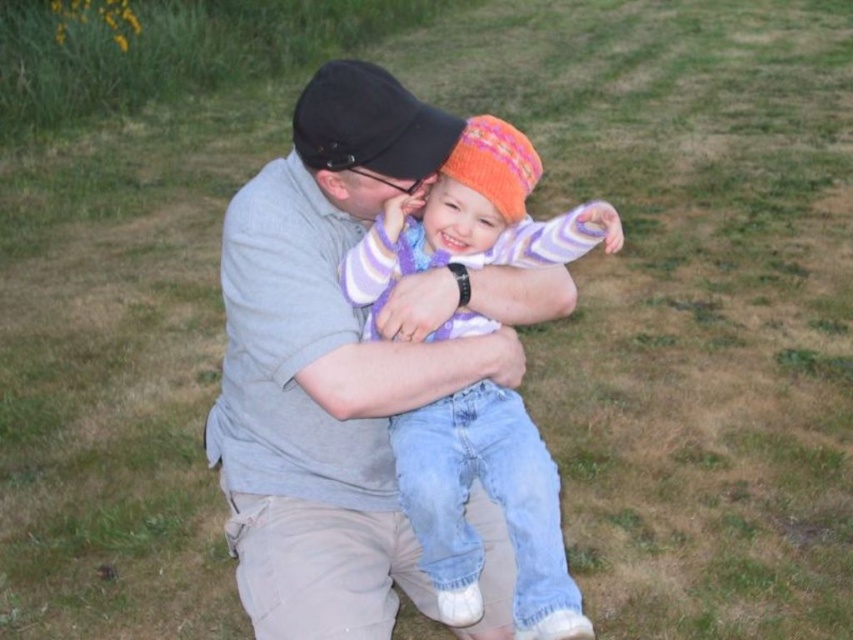
Is knitted woolen hat at center in front of black fabric cap at upper center?

Yes, it is in front of black fabric cap at upper center.

Who is positioned more to the left, knitted woolen hat at center or black fabric cap at upper center?

black fabric cap at upper center is more to the left.

Does point (498, 252) come farther from viewer compared to point (310, 81)?

That is True.

Image resolution: width=853 pixels, height=640 pixels. In order to click on knitted woolen hat at center in this screenshot , I will do click(x=495, y=499).